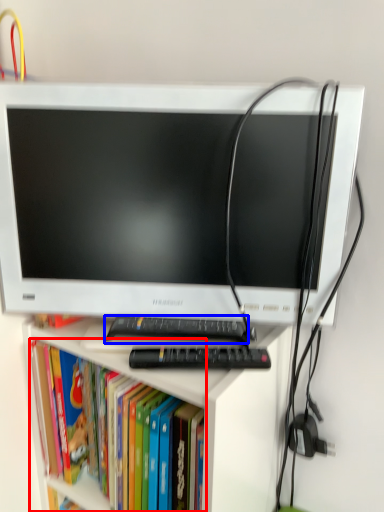
Question: Which object is closer to the camera taking this photo, book (highlighted by a red box) or keyboard (highlighted by a blue box)?

Choices:
 (A) book
 (B) keyboard

Answer: (A)